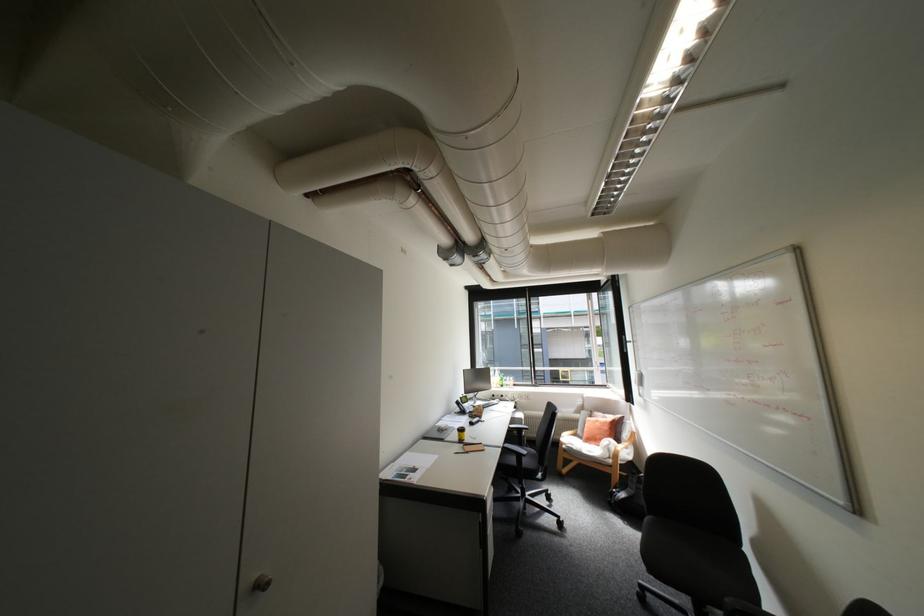
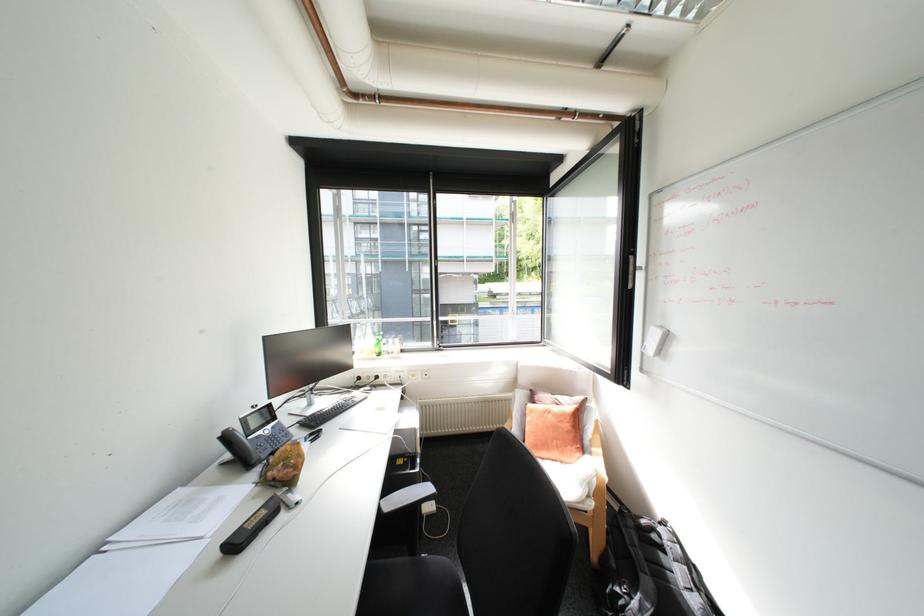
The point at (531, 419) is marked in the first image. Where is the corresponding point in the second image?

(424, 429)